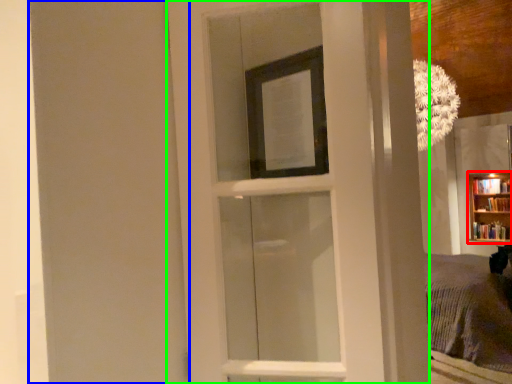
Question: Based on their relative distances, which object is farther from bookcase (highlighted by a red box)? Choose from screen door (highlighted by a blue box) and door (highlighted by a green box).

Choices:
 (A) screen door
 (B) door

Answer: (A)